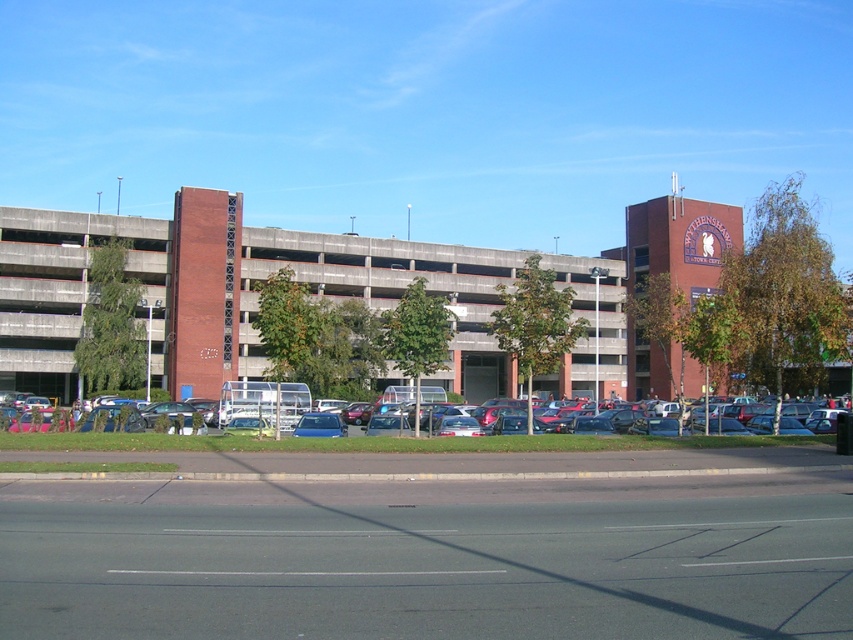
You are standing at the entrance of the parking structure and see two points marked on the ground in front of you. The first point is labeled as point (387, 632) and the second is point (102, 406). Which point is closer to you?

Point (387, 632) is in front of point (102, 406), so it is closer to you.